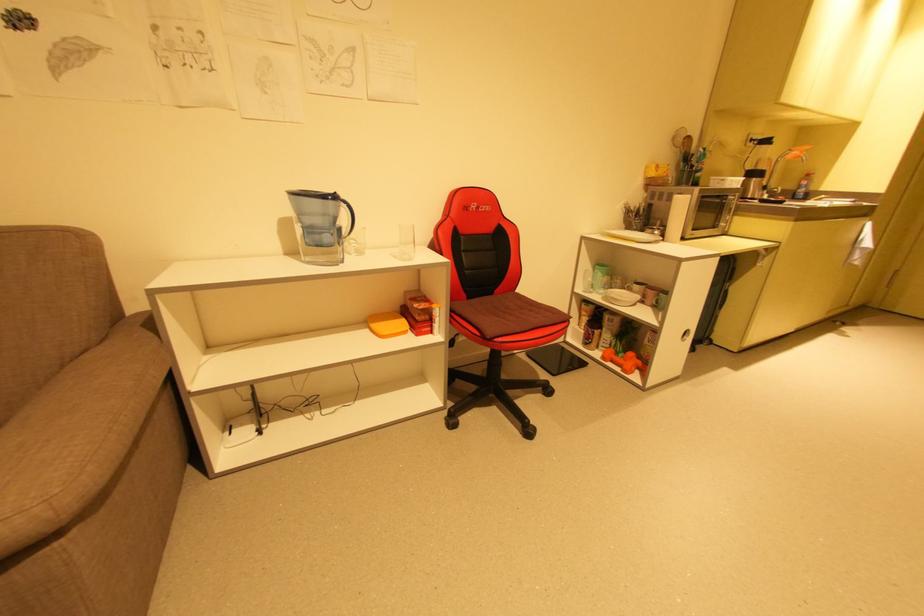
The image size is (924, 616). What are the coordinates of `red chair sitting surface` in the screenshot? It's located at (519, 313).